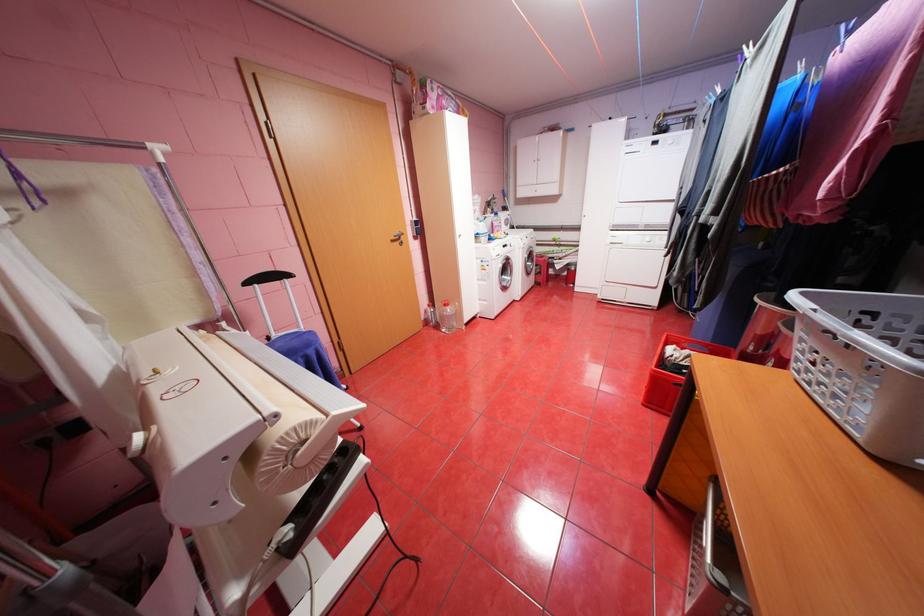
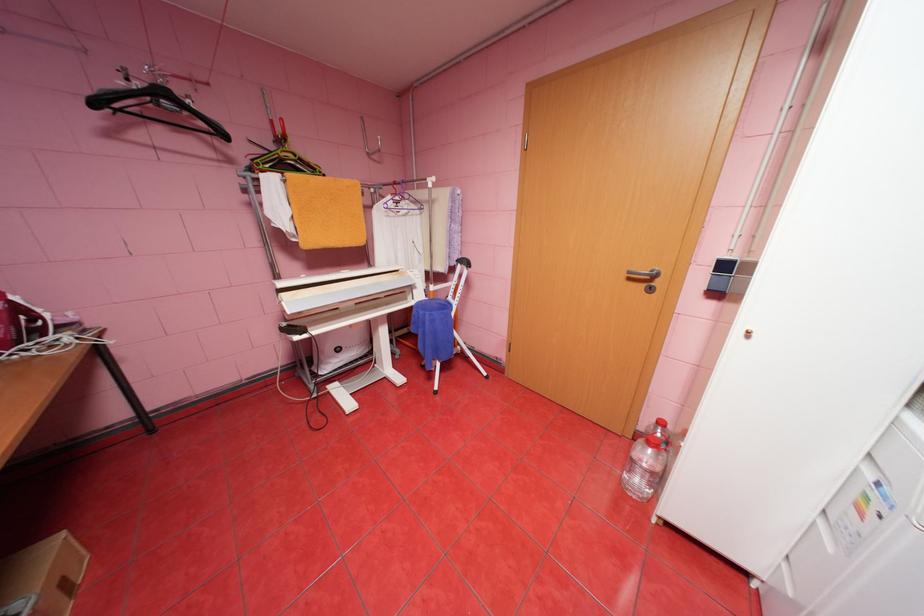
Find the pixel in the second image that matches pixel 445 326 in the first image.

(645, 459)